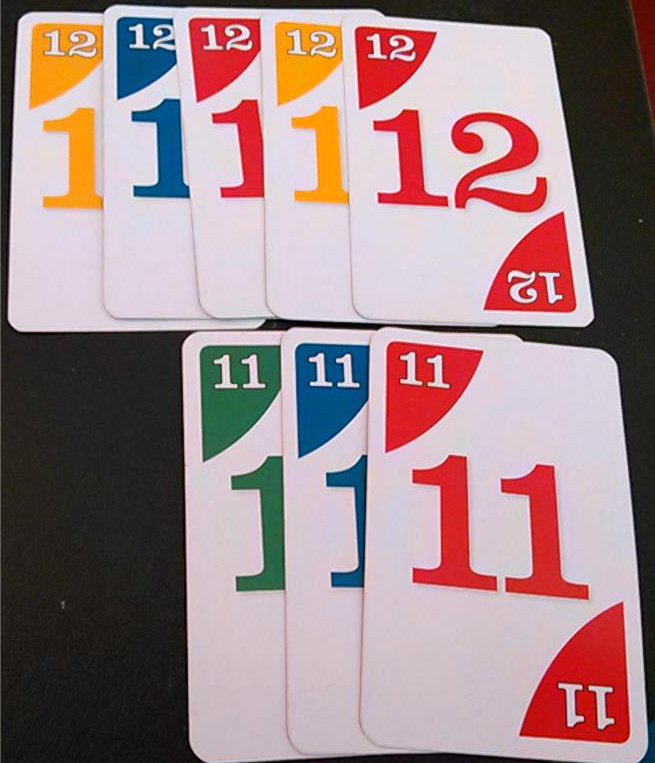
Find the location of a particular element. The image size is (655, 763). surface is located at coordinates (109, 619).